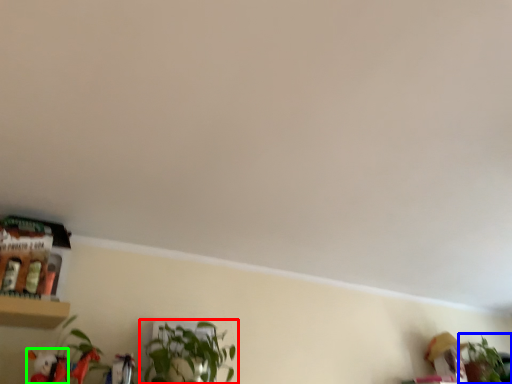
Question: Which is nearer to the houseplant (highlighted by a red box)? houseplant (highlighted by a blue box) or toy (highlighted by a green box).

Choices:
 (A) houseplant
 (B) toy

Answer: (B)